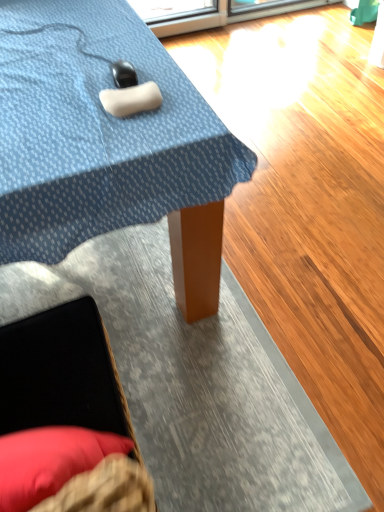
What are the coordinates of `free spot above matte blue table at upper left (from a real-world perspective)` in the screenshot? It's located at (86, 72).